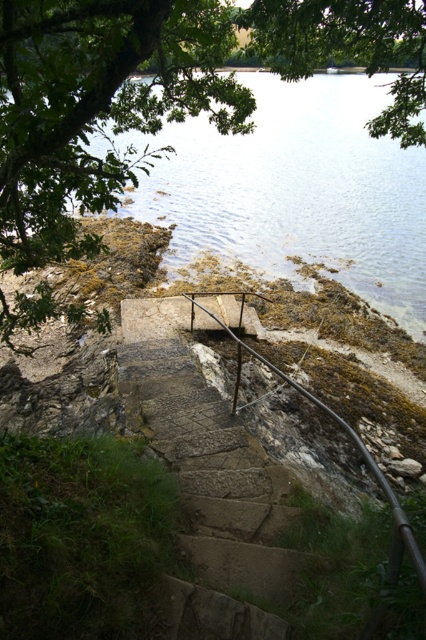
Question: Which object appears farthest from the camera in this image?

Choices:
 (A) green leafy tree at upper center
 (B) rusty metal railing at center

Answer: (A)

Question: Which object appears farthest from the camera in this image?

Choices:
 (A) green leafy tree at upper left
 (B) rusty metal railing at center
 (C) rustic stone stairs at center
 (D) green leafy tree at upper center

Answer: (D)

Question: Which object appears farthest from the camera in this image?

Choices:
 (A) green leafy tree at upper center
 (B) rustic stone stairs at center

Answer: (A)

Question: Does green leafy tree at upper center have a lesser width compared to rusty metal railing at center?

Choices:
 (A) no
 (B) yes

Answer: (A)

Question: Is rustic stone stairs at center smaller than green leafy tree at upper center?

Choices:
 (A) yes
 (B) no

Answer: (A)

Question: Can you confirm if green leafy tree at upper left is positioned to the left of rustic stone stairs at center?

Choices:
 (A) yes
 (B) no

Answer: (B)